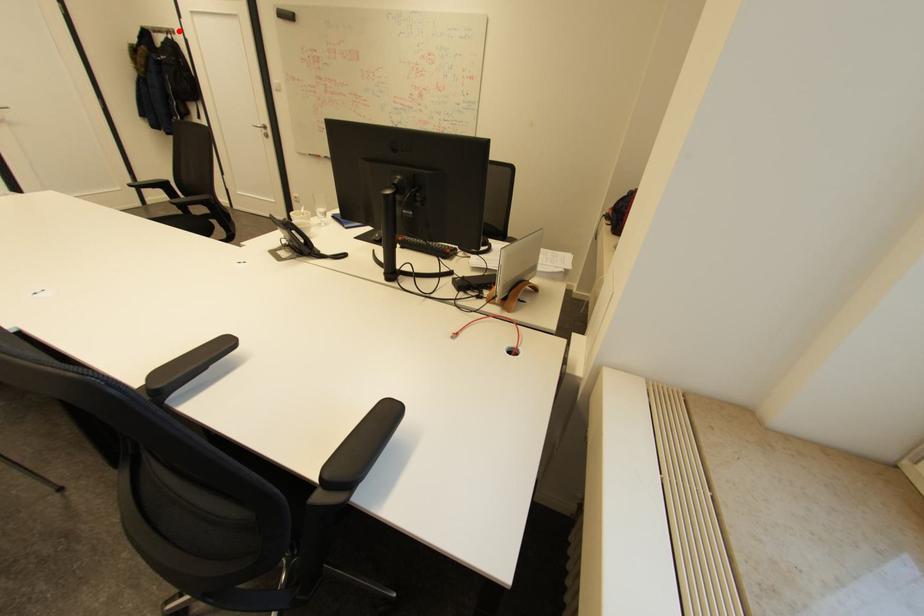
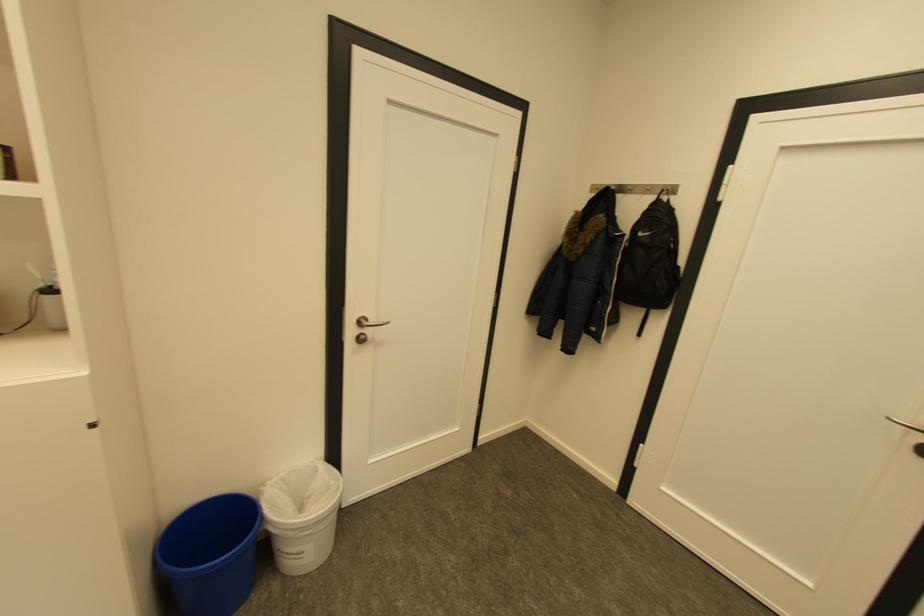
In the second image, find the point that corresponds to the highlighted location in the first image.

(677, 190)